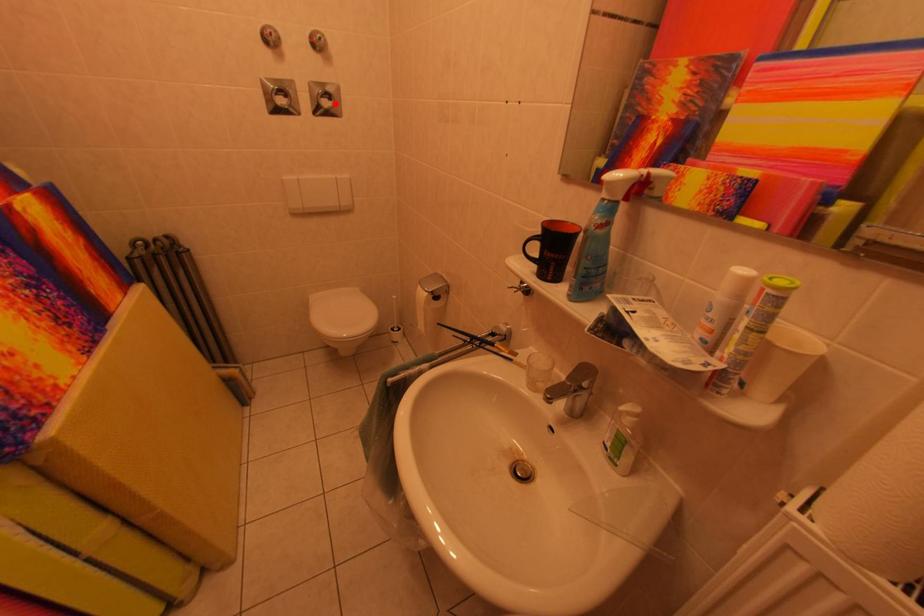
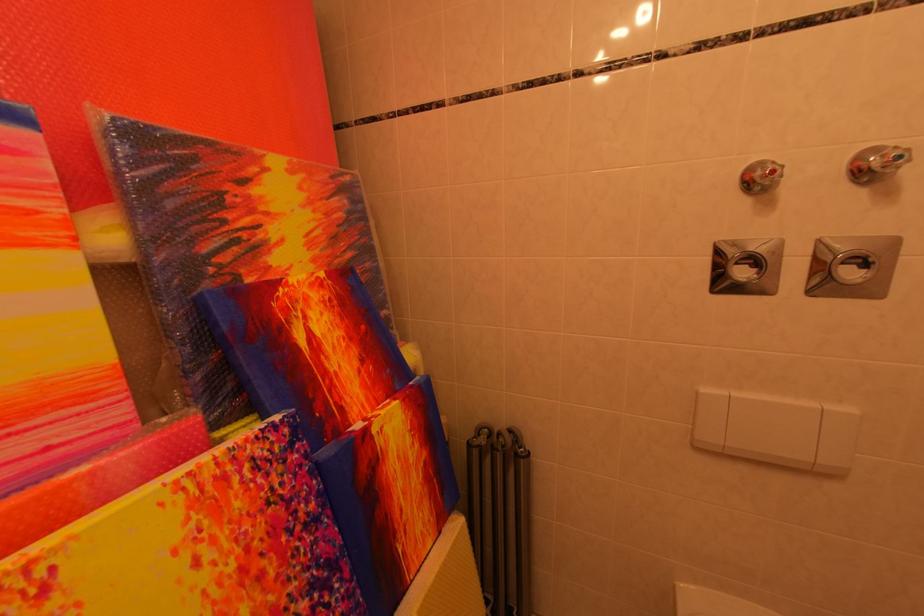
Where in the second image is the point corresponding to the highlighted location from the first image?

(864, 270)